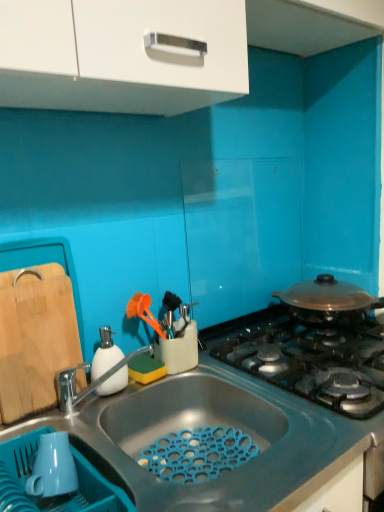
Where is `free space in front of silver metallic tap at sink left`? The width and height of the screenshot is (384, 512). free space in front of silver metallic tap at sink left is located at coordinates (110, 460).